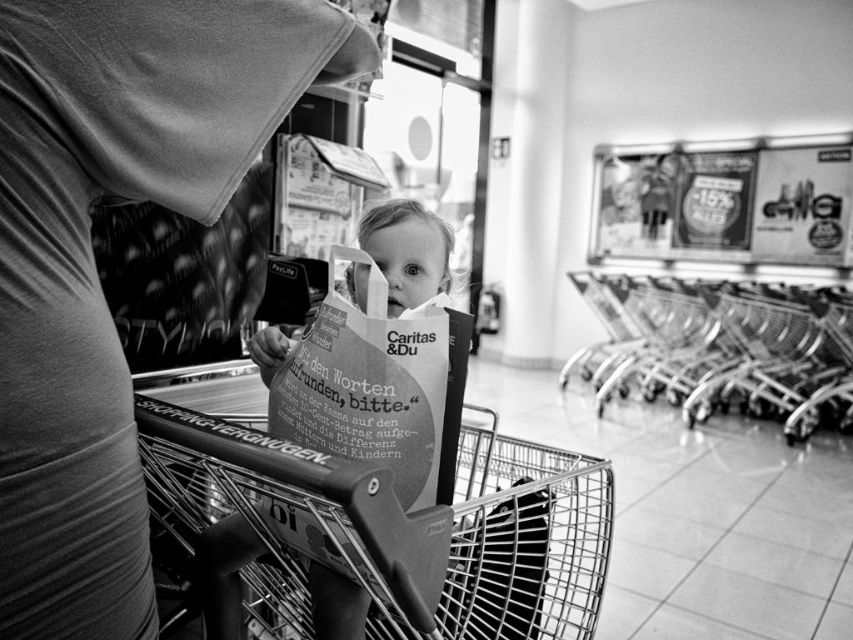
Is metallic silver trolley at right behind white paper bag at center?

Yes, it is behind white paper bag at center.

Does metallic silver trolley at right have a larger size compared to white paper bag at center?

Correct, metallic silver trolley at right is larger in size than white paper bag at center.

The width and height of the screenshot is (853, 640). What are the coordinates of `metallic silver trolley at right` in the screenshot? It's located at (722, 348).

Between metallic shopping cart at center and metallic silver trolley at right, which one appears on the right side from the viewer's perspective?

From the viewer's perspective, metallic silver trolley at right appears more on the right side.

Is point (276, 557) in front of point (834, 412)?

Yes, point (276, 557) is in front of point (834, 412).

This screenshot has width=853, height=640. In order to click on metallic shopping cart at center in this screenshot , I will do `click(401, 525)`.

Can you confirm if metallic shopping cart at center is smaller than white paper bag at center?

Actually, metallic shopping cart at center might be larger than white paper bag at center.

Is point (283, 468) positioned behind point (340, 348)?

No, (283, 468) is closer to viewer.

Which is in front, point (537, 518) or point (405, 417)?

Point (405, 417) is in front.

The height and width of the screenshot is (640, 853). I want to click on metallic shopping cart at center, so click(401, 525).